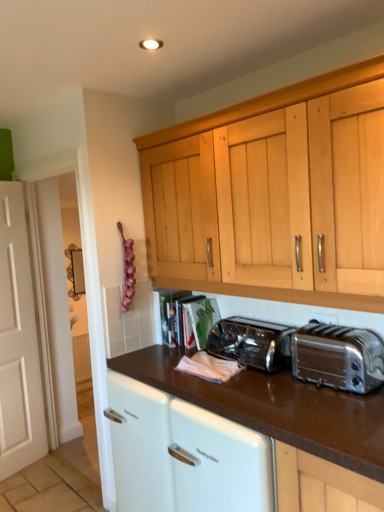
Where is `free spot in front of satin silver toaster at center, which is the 1th toaster from back to front`? free spot in front of satin silver toaster at center, which is the 1th toaster from back to front is located at coordinates (261, 385).